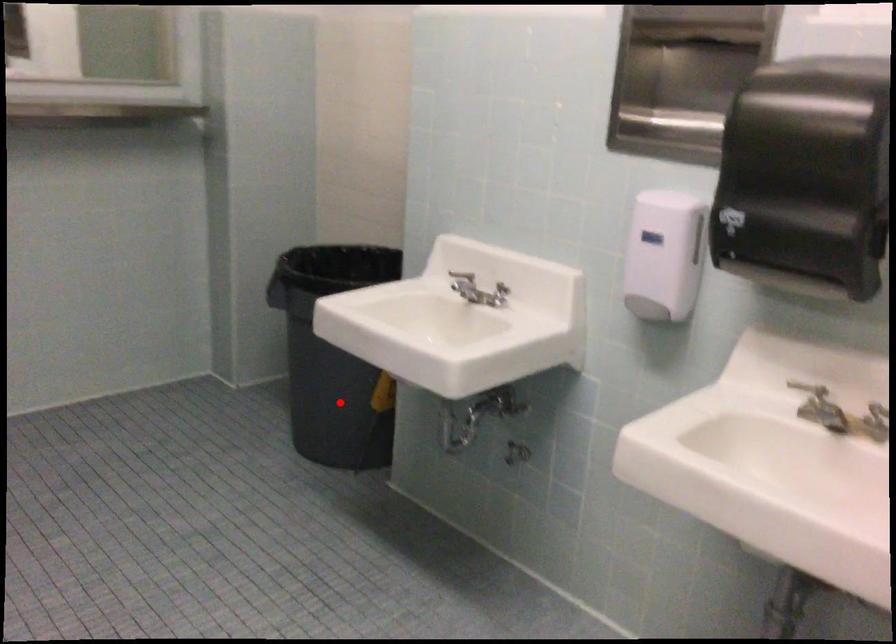
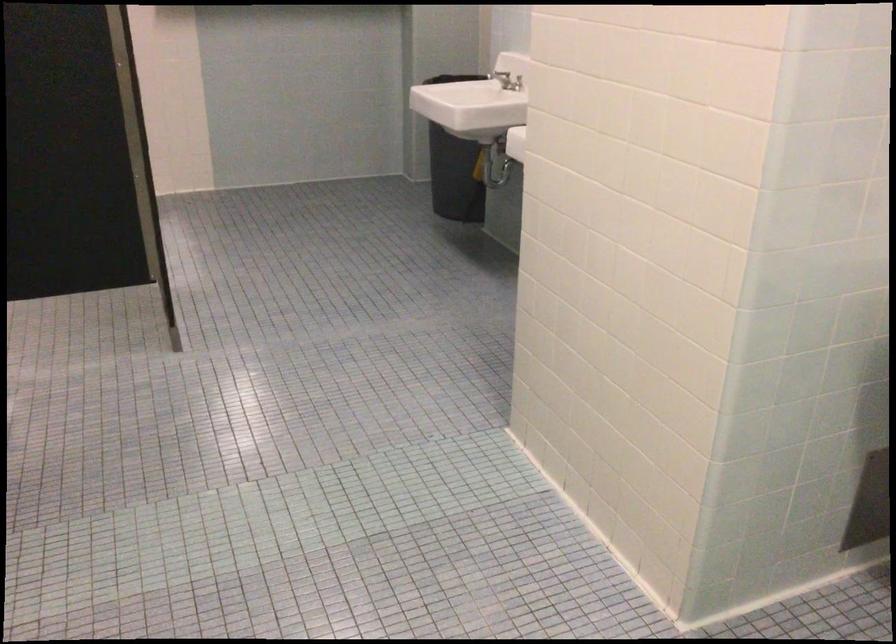
Question: I am providing you with two images of the same scene from different viewpoints. Image1 has a red point marked. In image2, the corresponding 3D location appears at what relative position? Reply with the corresponding letter.

Choices:
 (A) Closer
 (B) Farther

Answer: (B)